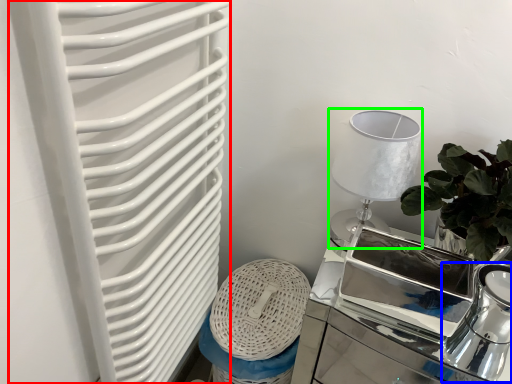
Question: Which is farther away from radiator (highlighted by a red box)? tea pot (highlighted by a blue box) or table lamp (highlighted by a green box)?

Choices:
 (A) tea pot
 (B) table lamp

Answer: (A)